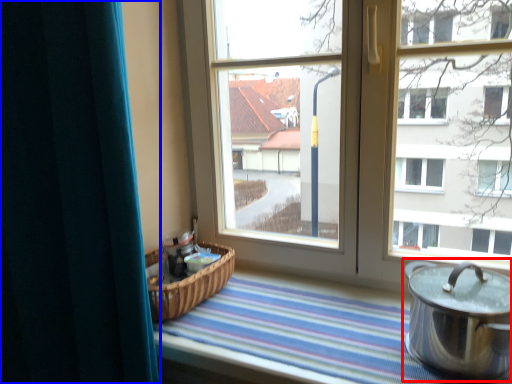
Question: Which object is closer to the camera taking this photo, crock pot (highlighted by a red box) or curtain (highlighted by a blue box)?

Choices:
 (A) crock pot
 (B) curtain

Answer: (B)